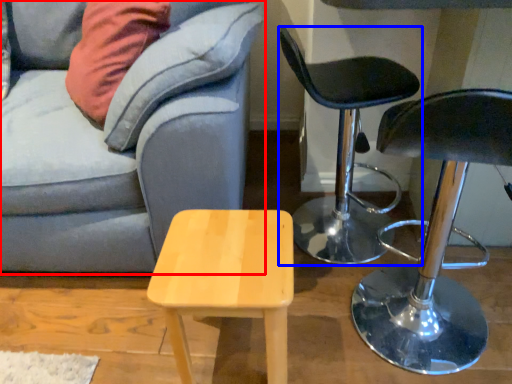
Question: Which object appears closest to the camera in this image, studio couch (highlighted by a red box) or chair (highlighted by a blue box)?

Choices:
 (A) studio couch
 (B) chair

Answer: (A)